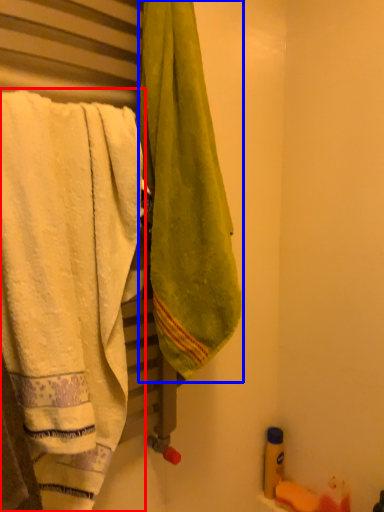
Question: Which object is further to the camera taking this photo, towel (highlighted by a red box) or towel (highlighted by a blue box)?

Choices:
 (A) towel
 (B) towel

Answer: (B)